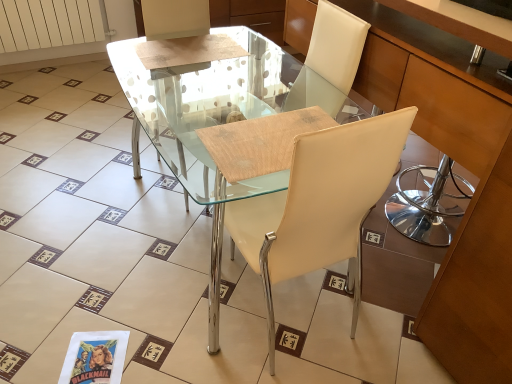
Where is `vacant space positioned to the left of transparent glass table at center`? vacant space positioned to the left of transparent glass table at center is located at coordinates (79, 220).